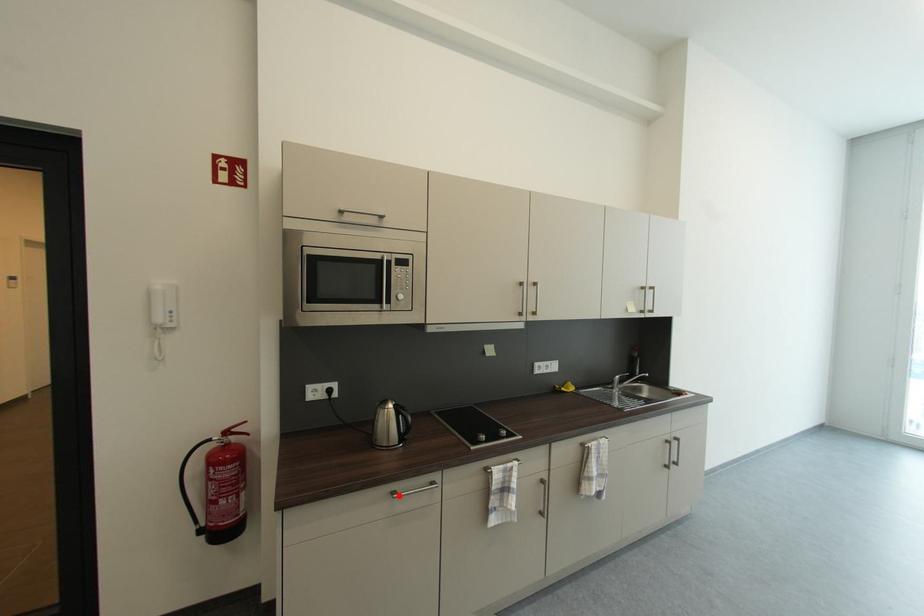
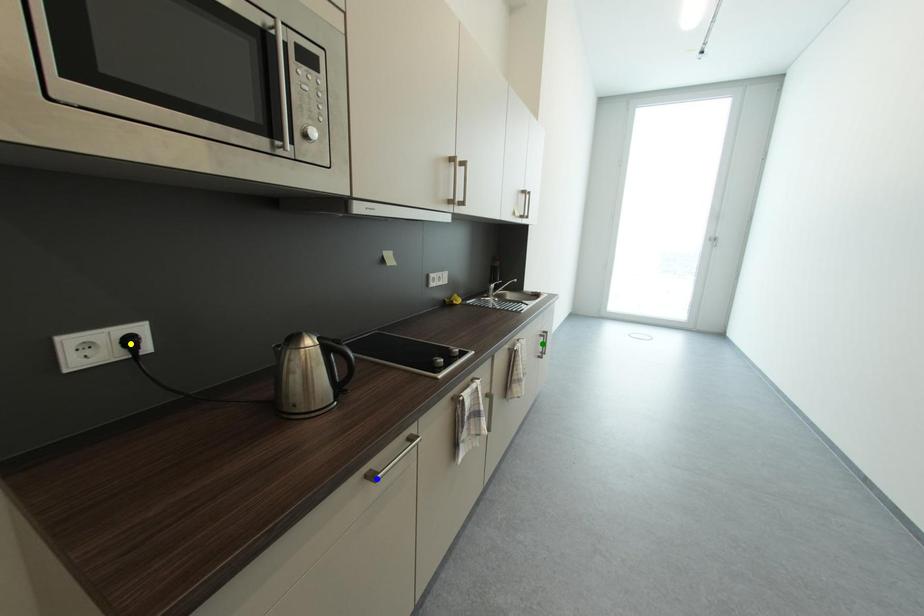
Question: I am providing you with two images of the same scene from different viewpoints. A red point is marked on the first image. You are given multiple points on the second image. Which point in image 2 represents the same 3d spot as the red point in image 1?

Choices:
 (A) yellow point
 (B) blue point
 (C) green point

Answer: (B)